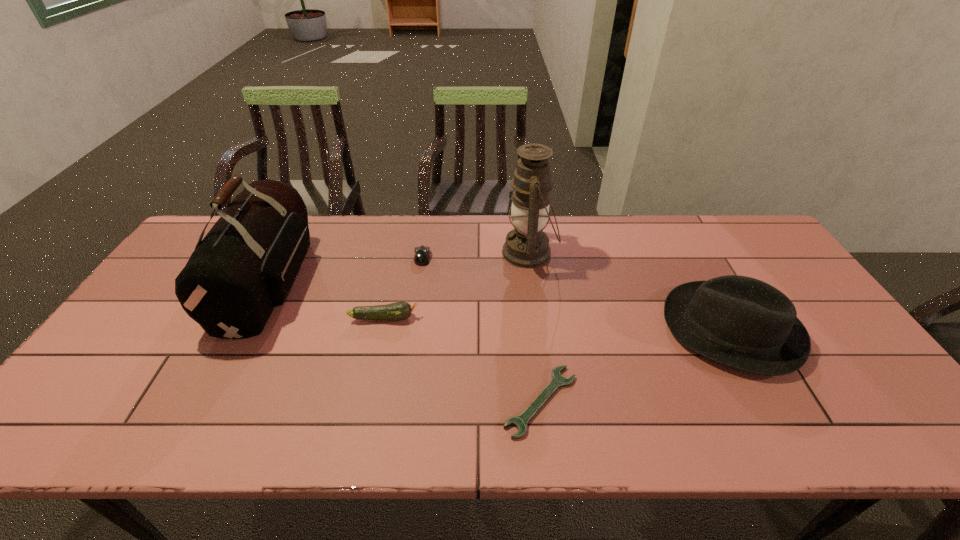
Find the location of `free space at the left edge`. free space at the left edge is located at coordinates (116, 376).

What are the coordinates of `vacant space in between the shortest object and the duffel bag` in the screenshot? It's located at (405, 342).

The width and height of the screenshot is (960, 540). What are the coordinates of `empty location between the wrench and the zucchini` in the screenshot? It's located at (463, 359).

This screenshot has width=960, height=540. Find the location of `free space between the oil lamp and the third shortest object`. free space between the oil lamp and the third shortest object is located at coordinates (457, 285).

Find the location of a particular element. The height and width of the screenshot is (540, 960). free space between the oil lamp and the mouse is located at coordinates (476, 255).

Find the location of a particular element. This screenshot has width=960, height=540. vacant area between the leftmost object and the shortest object is located at coordinates (405, 342).

Identify the location of empty space between the wrench and the oil lamp. The image size is (960, 540). (535, 327).

Identify the location of blank region between the third shortest object and the oil lamp. This screenshot has height=540, width=960. click(457, 285).

Locate an element on the screen. The height and width of the screenshot is (540, 960). free area in between the zucchini and the fedora is located at coordinates (557, 323).

Find the location of `unoccupied position between the fourth tallest object and the mouse`. unoccupied position between the fourth tallest object and the mouse is located at coordinates (403, 287).